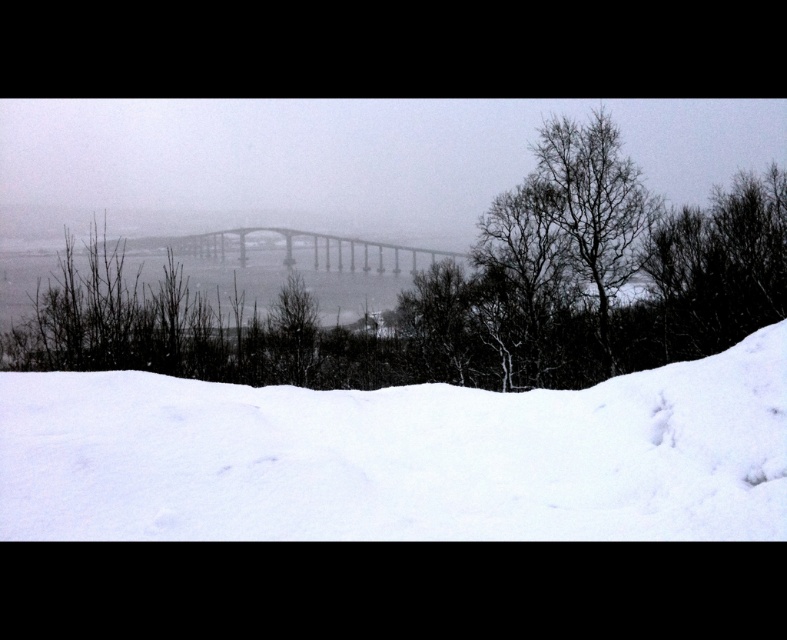
Question: Among these points, which one is farthest from the camera?

Choices:
 (A) (316, 252)
 (B) (198, 474)

Answer: (A)

Question: Can you confirm if white snow at lower center is positioned below gray metallic bridge at center?

Choices:
 (A) no
 (B) yes

Answer: (B)

Question: Is white snow at lower center below gray metallic bridge at center?

Choices:
 (A) no
 (B) yes

Answer: (B)

Question: Is white snow at lower center to the right of gray metallic bridge at center from the viewer's perspective?

Choices:
 (A) no
 (B) yes

Answer: (B)